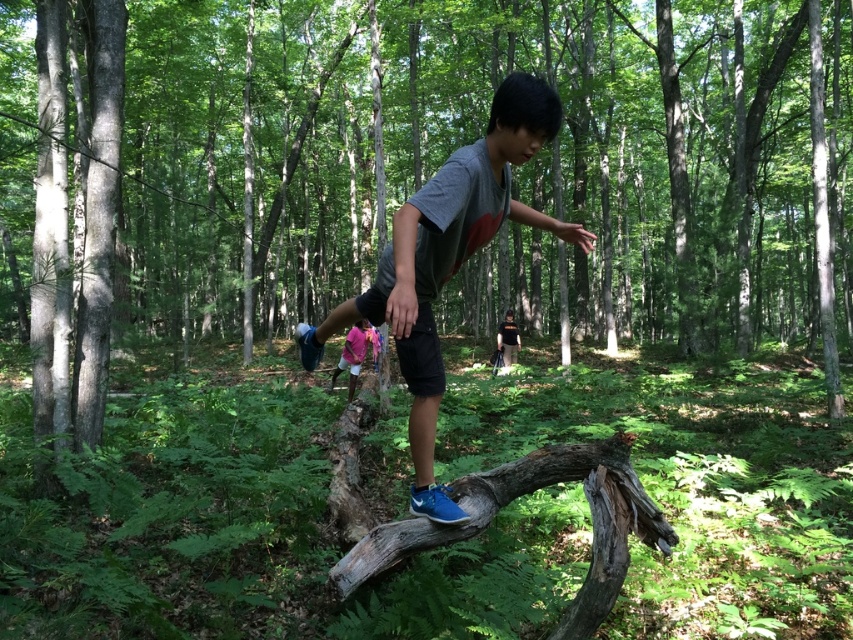
Does gray cotton t-shirt at center appear on the right side of pink fabric shorts at center?

Indeed, gray cotton t-shirt at center is positioned on the right side of pink fabric shorts at center.

The height and width of the screenshot is (640, 853). Identify the location of gray cotton t-shirt at center. (448, 260).

The height and width of the screenshot is (640, 853). Identify the location of gray cotton t-shirt at center. (448, 260).

Is gray cotton t-shirt at center to the right of black matte shirt at center from the viewer's perspective?

Incorrect, gray cotton t-shirt at center is not on the right side of black matte shirt at center.

Measure the distance between gray cotton t-shirt at center and black matte shirt at center.

gray cotton t-shirt at center is 9.16 meters from black matte shirt at center.

Locate an element on the screen. gray cotton t-shirt at center is located at coordinates (448, 260).

Is point (369, 336) positioned after point (506, 333)?

No, (369, 336) is closer to viewer.

This screenshot has width=853, height=640. What do you see at coordinates (354, 353) in the screenshot?
I see `pink fabric shorts at center` at bounding box center [354, 353].

Identify the location of pink fabric shorts at center. This screenshot has height=640, width=853. [x=354, y=353].